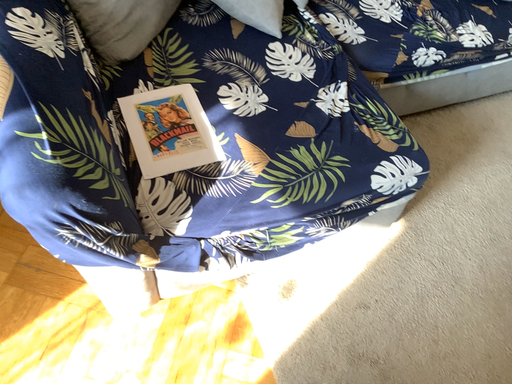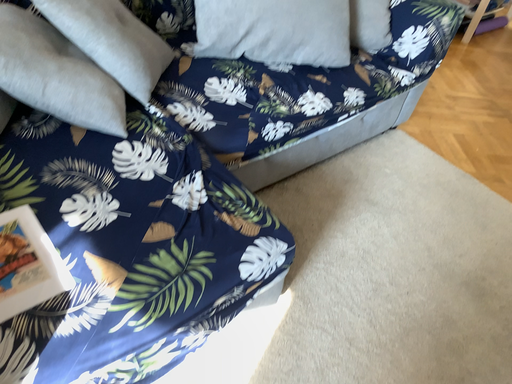
Question: How did the camera likely rotate when shooting the video?

Choices:
 (A) rotated left
 (B) rotated right

Answer: (B)